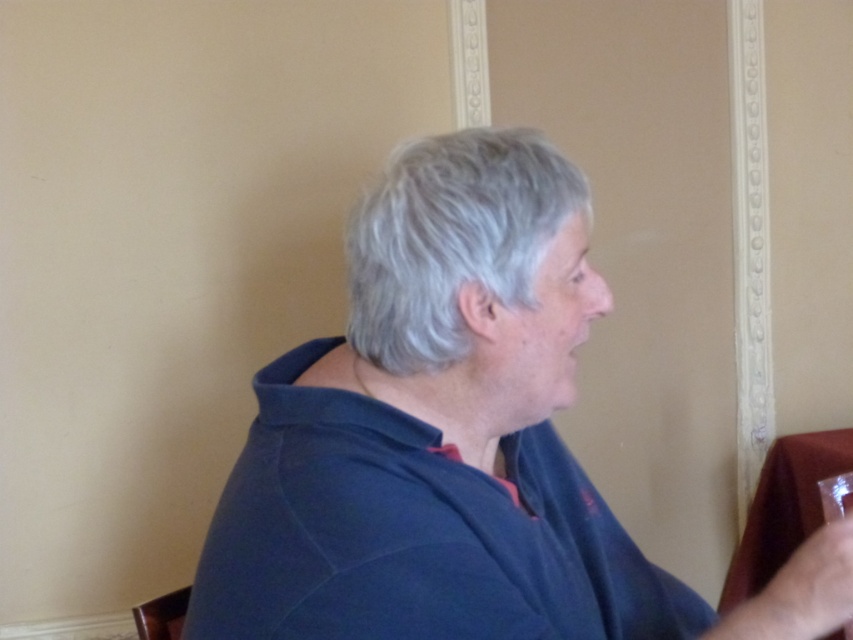
You are standing in the room and want to determine which of the two points, point [390,308] or point [834,497], is nearer to you. Based on the scene description, which point is closer?

Point [390,308] is closer to the camera than point [834,497], so it is the nearer point.

You are a photographer setting up a shoot in the described scene. You need to ensure that the dark blue shirt at center and the clear glass wine glass at right are both visible in the frame. Based on their sizes, which object should you position closer to the camera to maintain their visibility without overlapping?

The dark blue shirt at center is wider than the clear glass wine glass at right. To maintain visibility without overlapping, position the clear glass wine glass at right closer to the camera since it is narrower, allowing the wider dark blue shirt at center to stay further back but still visible.